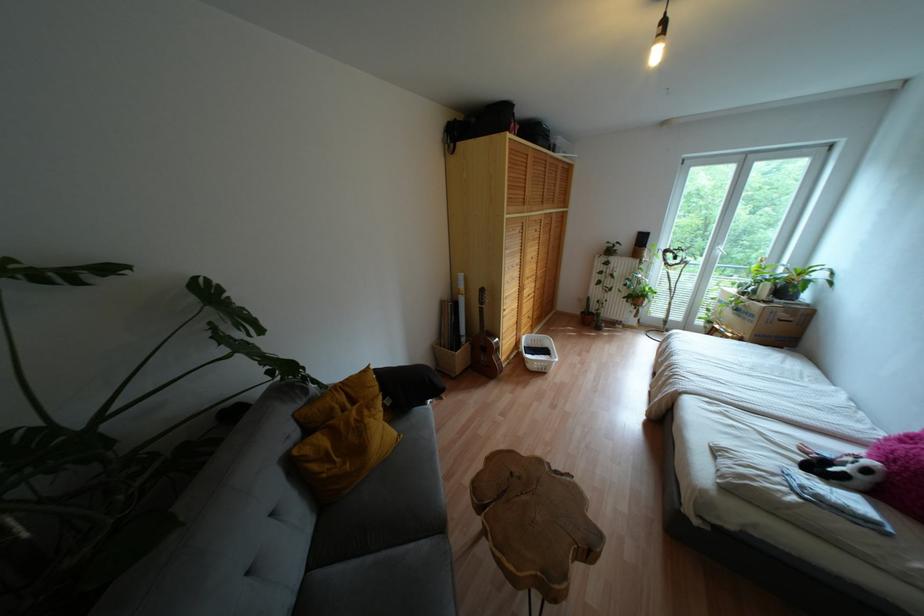
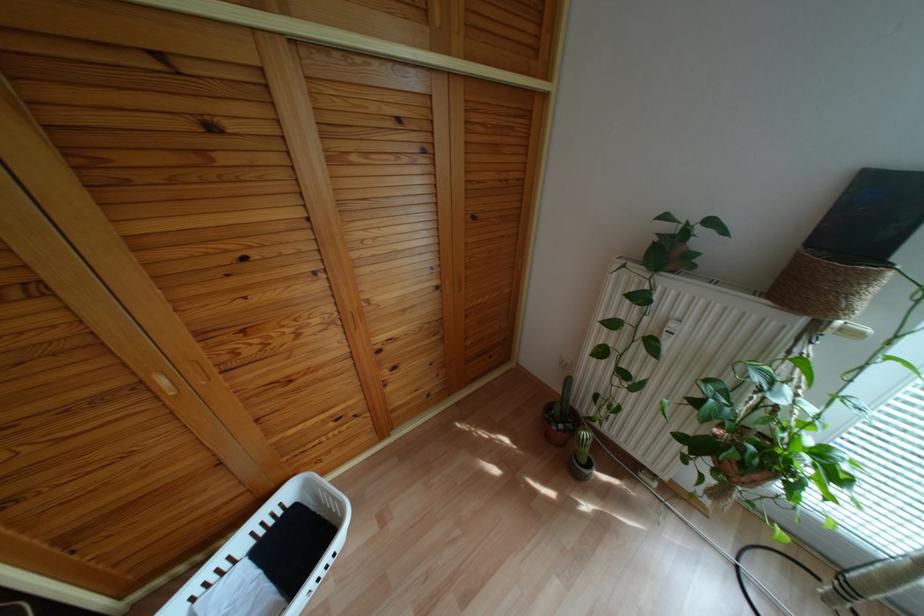
The point at [643,254] is marked in the first image. Where is the corresponding point in the second image?

(861, 302)